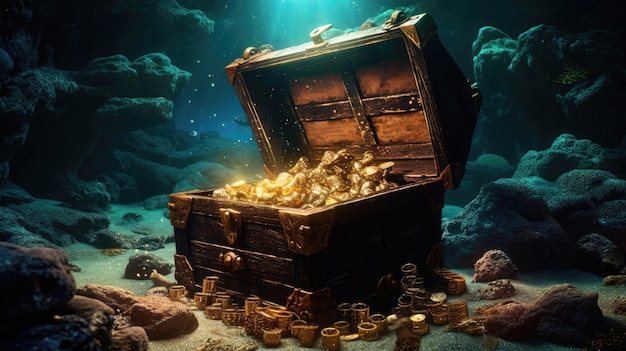
The width and height of the screenshot is (626, 351). Find the location of `front upper corners of chest`. front upper corners of chest is located at coordinates (305, 215), (168, 197).